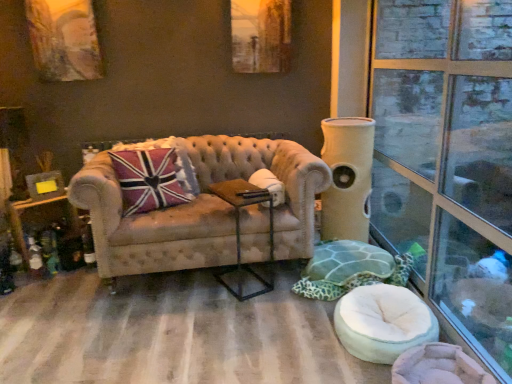
Where is `vacant space to the right of metallic brown side table at center`? The height and width of the screenshot is (384, 512). vacant space to the right of metallic brown side table at center is located at coordinates (277, 277).